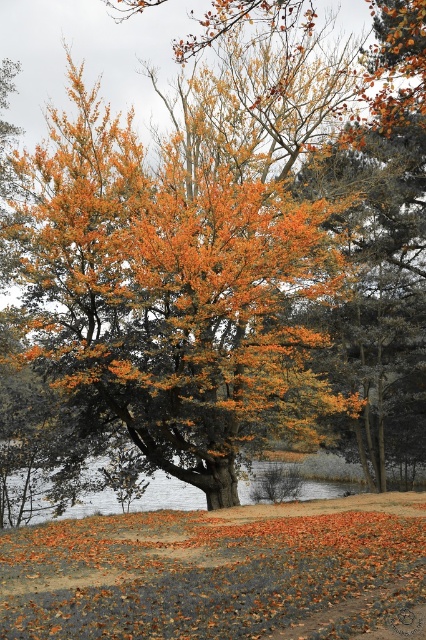
Does orange leafy tree at center have a greater width compared to orange leaf litter at lower center?

Indeed, orange leafy tree at center has a greater width compared to orange leaf litter at lower center.

Can you confirm if orange leafy tree at center is positioned to the right of orange leaf litter at lower center?

In fact, orange leafy tree at center is to the left of orange leaf litter at lower center.

What do you see at coordinates (183, 272) in the screenshot? I see `orange leafy tree at center` at bounding box center [183, 272].

This screenshot has height=640, width=426. I want to click on orange leafy tree at center, so click(x=183, y=272).

Is orange leafy tree at center positioned in front of smooth gray water at lower center?

Yes, it is in front of smooth gray water at lower center.

The width and height of the screenshot is (426, 640). Describe the element at coordinates (183, 272) in the screenshot. I see `orange leafy tree at center` at that location.

Locate an element on the screen. orange leafy tree at center is located at coordinates (183, 272).

Where is `orange leaf litter at lower center`? The image size is (426, 640). orange leaf litter at lower center is located at coordinates (221, 573).

Between point (258, 564) and point (242, 490), which one is positioned in front?

Point (258, 564) is more forward.

You are a GUI agent. You are given a task and a screenshot of the screen. Output one action in this format:
    pyautogui.click(x=<x>, y=<y>)
    Task: Click on the orange leaf litter at lower center
    
    Given the screenshot: What is the action you would take?
    pyautogui.click(x=221, y=573)